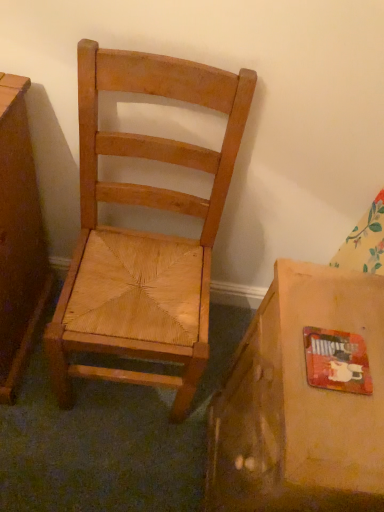
I want to click on natural wood chair at center, so click(x=143, y=232).

What do you see at coordinates (143, 232) in the screenshot?
I see `natural wood chair at center` at bounding box center [143, 232].

In order to face natural wood chair at center, should I rotate leftwards or rightwards?

It's best to rotate left around 7.342 degrees.

This screenshot has height=512, width=384. Describe the element at coordinates (299, 404) in the screenshot. I see `matte cardboard box at lower right` at that location.

What are the coordinates of `matte cardboard box at lower right` in the screenshot? It's located at (299, 404).

This screenshot has height=512, width=384. Find the location of `natural wood chair at center`. natural wood chair at center is located at coordinates (143, 232).

Which object is positioned more to the left, natural wood chair at center or matte cardboard box at lower right?

From the viewer's perspective, natural wood chair at center appears more on the left side.

Is the position of natural wood chair at center less distant than that of matte cardboard box at lower right?

No.

Is point (140, 340) closer or farther from the camera than point (275, 295)?

Point (140, 340) is farther from the camera than point (275, 295).

From the image's perspective, is natural wood chair at center under matte cardboard box at lower right?

Actually, natural wood chair at center appears above matte cardboard box at lower right in the image.

From a real-world perspective, which object rests below the other?

matte cardboard box at lower right.

Is natural wood chair at center thinner than matte cardboard box at lower right?

In fact, natural wood chair at center might be wider than matte cardboard box at lower right.

Is natural wood chair at center taller than matte cardboard box at lower right?

Indeed, natural wood chair at center has a greater height compared to matte cardboard box at lower right.

Considering the sizes of objects natural wood chair at center and matte cardboard box at lower right in the image provided, who is bigger, natural wood chair at center or matte cardboard box at lower right?

With larger size is natural wood chair at center.

Is natural wood chair at center inside the boundaries of matte cardboard box at lower right, or outside?

natural wood chair at center is spatially situated outside matte cardboard box at lower right.

Is natural wood chair at center beside matte cardboard box at lower right?

natural wood chair at center and matte cardboard box at lower right are clearly separated.

Is matte cardboard box at lower right at the back of natural wood chair at center?

No.

Consider the image. What's the angular difference between natural wood chair at center and matte cardboard box at lower right's facing directions?

89.6 degrees separate the facing orientations of natural wood chair at center and matte cardboard box at lower right.

You are a GUI agent. You are given a task and a screenshot of the screen. Output one action in this format:
    pyautogui.click(x=<x>, y=<y>)
    Task: Click on the cardboard box in front of the natural wood chair at center
    The height and width of the screenshot is (512, 384).
    Given the screenshot: What is the action you would take?
    (x=299, y=404)

Can you confirm if matte cardboard box at lower right is positioned to the right of natural wood chair at center?

Correct, you'll find matte cardboard box at lower right to the right of natural wood chair at center.

Is matte cardboard box at lower right further to the viewer compared to natural wood chair at center?

No, it is not.

Which is less distant, (264, 361) or (129, 243)?

Point (264, 361).

From the image's perspective, is matte cardboard box at lower right over natural wood chair at center?

Actually, matte cardboard box at lower right appears below natural wood chair at center in the image.

From a real-world perspective, is matte cardboard box at lower right above or below natural wood chair at center?

matte cardboard box at lower right is situated lower than natural wood chair at center in the real world.

In terms of width, does matte cardboard box at lower right look wider or thinner when compared to natural wood chair at center?

In the image, matte cardboard box at lower right appears to be more narrow than natural wood chair at center.

Does matte cardboard box at lower right have a lesser height compared to natural wood chair at center?

Yes.

Which of these two, matte cardboard box at lower right or natural wood chair at center, is smaller?

With smaller size is matte cardboard box at lower right.

Is matte cardboard box at lower right surrounding natural wood chair at center?

No, natural wood chair at center is not inside matte cardboard box at lower right.

Based on the photo, are matte cardboard box at lower right and natural wood chair at center beside each other?

There is a gap between matte cardboard box at lower right and natural wood chair at center.

Is matte cardboard box at lower right aimed at natural wood chair at center?

No.

How different are the orientations of matte cardboard box at lower right and natural wood chair at center in degrees?

They differ by 89.6 degrees in their facing directions.

Measure the distance from matte cardboard box at lower right to natural wood chair at center.

34.00 centimeters.

In order to click on cardboard box below the natural wood chair at center (from the image's perspective) in this screenshot , I will do `click(299, 404)`.

At what (x,y) coordinates should I click in order to perform the action: click on chair above the matte cardboard box at lower right (from a real-world perspective). Please return your answer as a coordinate pair (x, y). Looking at the image, I should click on (143, 232).

Locate an element on the screen. This screenshot has width=384, height=512. cardboard box on the right of natural wood chair at center is located at coordinates (299, 404).